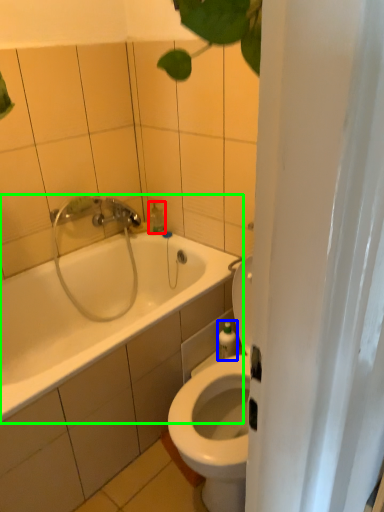
Question: Based on their relative distances, which object is nearer to soap dispenser (highlighted by a red box)? Choose from toiletry (highlighted by a blue box) and bathtub (highlighted by a green box).

Choices:
 (A) toiletry
 (B) bathtub

Answer: (B)